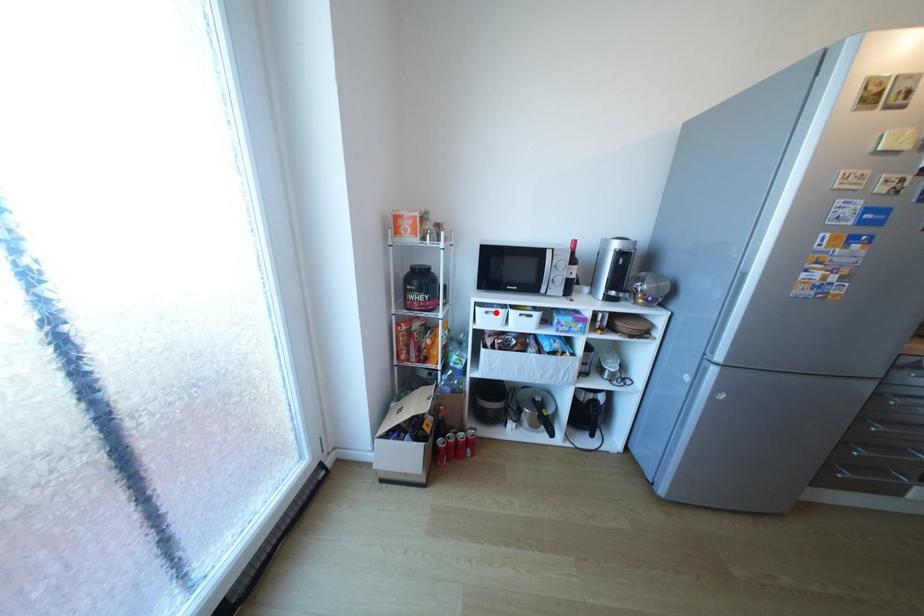
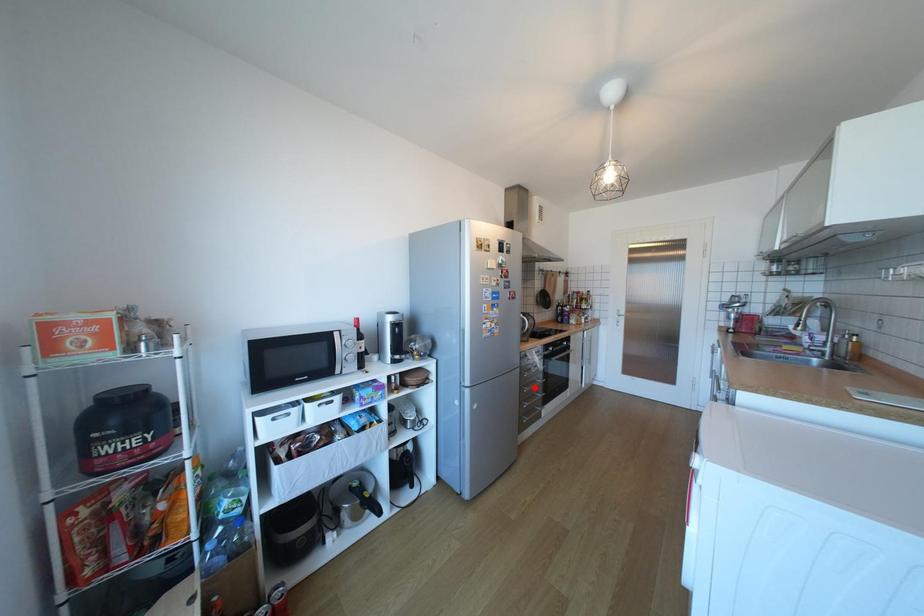
I am providing you with two images of the same scene from different viewpoints. A red point is marked on the first image and another point is marked on the second image. Is the marked point in image1 the same physical position as the marked point in image2?

No